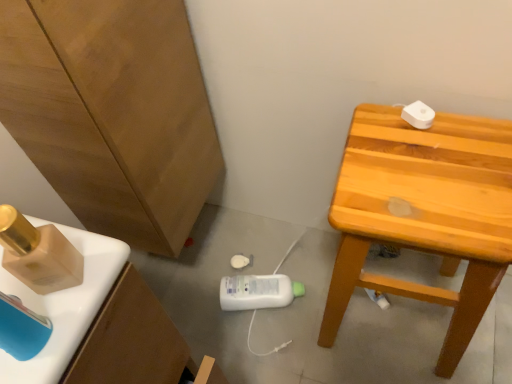
Question: Considering their positions, is light brown wooden stool at upper right located in front of or behind matte wood cabinet at left?

Choices:
 (A) behind
 (B) front

Answer: (A)

Question: From a real-world perspective, is light brown wooden stool at upper right positioned above or below matte wood cabinet at left?

Choices:
 (A) below
 (B) above

Answer: (A)

Question: Is point (350, 296) positioned closer to the camera than point (156, 145)?

Choices:
 (A) farther
 (B) closer

Answer: (A)

Question: Considering their positions, is matte wood cabinet at left located in front of or behind light brown wooden stool at upper right?

Choices:
 (A) front
 (B) behind

Answer: (A)

Question: Is point [139, 124] positioned closer to the camera than point [472, 326]?

Choices:
 (A) closer
 (B) farther

Answer: (A)

Question: In the image, is matte wood cabinet at left on the left side or the right side of light brown wooden stool at upper right?

Choices:
 (A) right
 (B) left

Answer: (B)

Question: From a real-world perspective, is matte wood cabinet at left positioned above or below light brown wooden stool at upper right?

Choices:
 (A) above
 (B) below

Answer: (A)